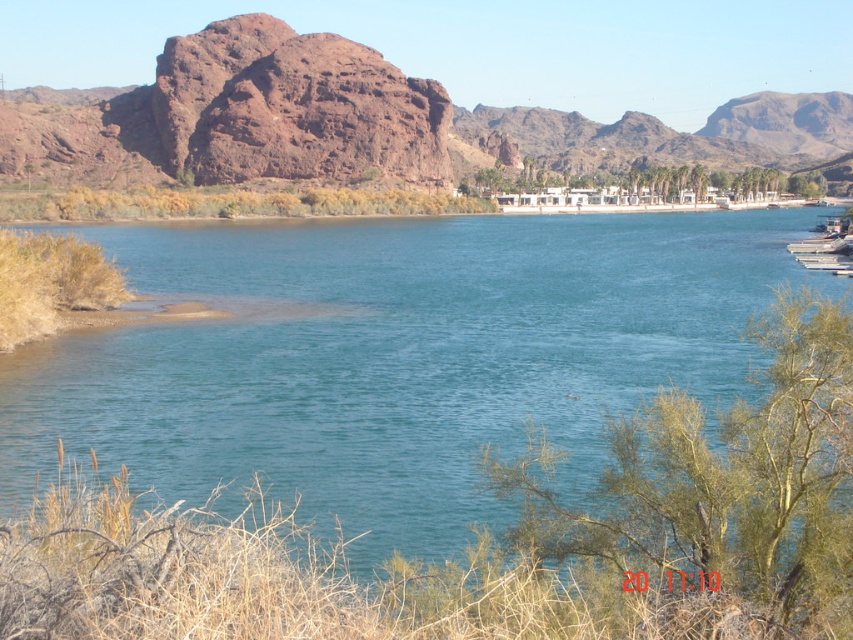
Question: Which point is closer to the camera taking this photo?

Choices:
 (A) (498, 131)
 (B) (317, 502)

Answer: (B)

Question: Can you confirm if blue water at center is positioned above rustic rock formation at upper center?

Choices:
 (A) yes
 (B) no

Answer: (B)

Question: Which point appears farthest from the camera in this image?

Choices:
 (A) (445, 550)
 (B) (74, 132)

Answer: (B)

Question: Can you confirm if blue water at center is positioned below rustic rock formation at upper center?

Choices:
 (A) yes
 (B) no

Answer: (A)

Question: Can you confirm if blue water at center is wider than rustic rock formation at upper center?

Choices:
 (A) no
 (B) yes

Answer: (A)